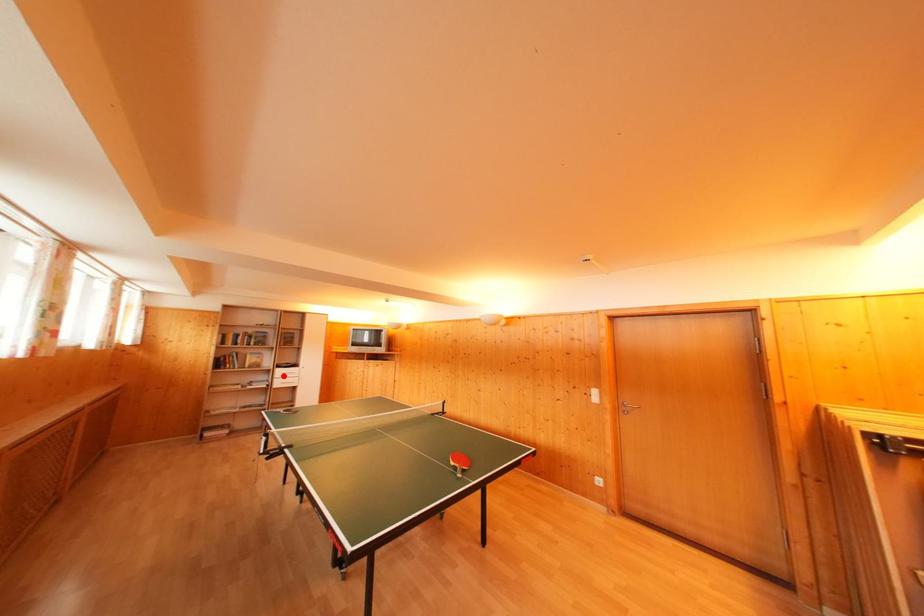
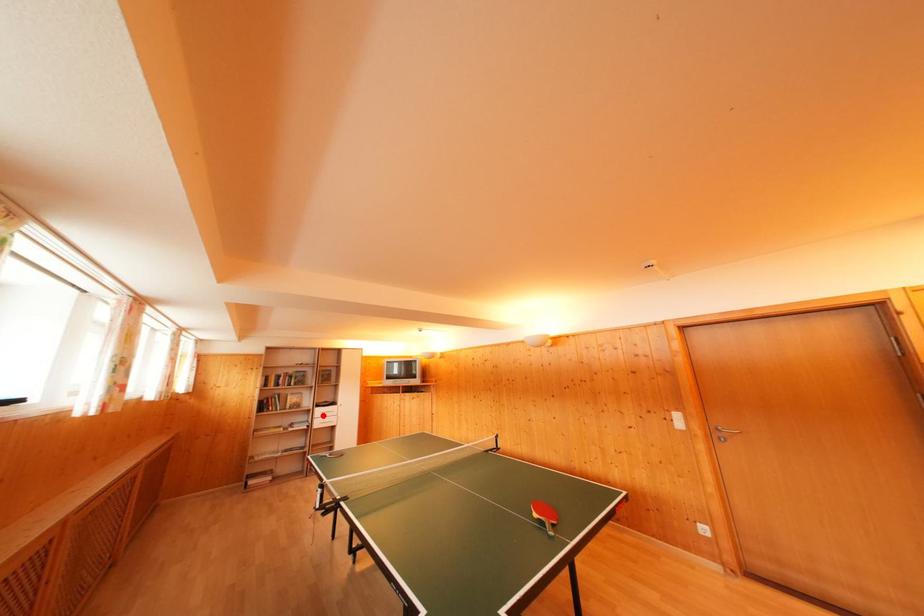
I am providing you with two images of the same scene from different viewpoints. A red point is marked on the first image and another point is marked on the second image. Is the red point in image1 aligned with the point shown in image2?

Yes